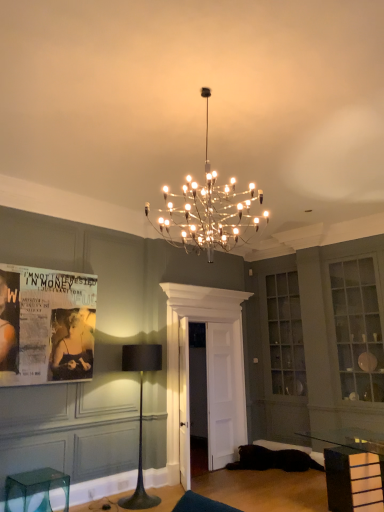
Question: Can you see matte paper poster at left touching black fabric lamp at center?

Choices:
 (A) yes
 (B) no

Answer: (B)

Question: From a real-world perspective, is matte paper poster at left physically above black fabric lamp at center?

Choices:
 (A) yes
 (B) no

Answer: (A)

Question: From a real-world perspective, is matte paper poster at left positioned under black fabric lamp at center based on gravity?

Choices:
 (A) no
 (B) yes

Answer: (A)

Question: Is matte paper poster at left at the left side of black fabric lamp at center?

Choices:
 (A) no
 (B) yes

Answer: (B)

Question: Considering the relative sizes of matte paper poster at left and black fabric lamp at center in the image provided, is matte paper poster at left wider than black fabric lamp at center?

Choices:
 (A) yes
 (B) no

Answer: (B)

Question: Is matte paper poster at left not inside black fabric lamp at center?

Choices:
 (A) yes
 (B) no

Answer: (A)

Question: Can you confirm if clear glass cabinet at upper right is positioned to the right of black fabric lamp at center?

Choices:
 (A) yes
 (B) no

Answer: (A)

Question: Can we say clear glass cabinet at upper right lies outside black fabric lamp at center?

Choices:
 (A) yes
 (B) no

Answer: (A)

Question: Is clear glass cabinet at upper right at the left side of black fabric lamp at center?

Choices:
 (A) yes
 (B) no

Answer: (B)

Question: Considering the relative sizes of clear glass cabinet at upper right and black fabric lamp at center in the image provided, is clear glass cabinet at upper right thinner than black fabric lamp at center?

Choices:
 (A) no
 (B) yes

Answer: (B)

Question: From the image's perspective, is clear glass cabinet at upper right below black fabric lamp at center?

Choices:
 (A) yes
 (B) no

Answer: (B)

Question: Is clear glass cabinet at upper right facing towards black fabric lamp at center?

Choices:
 (A) no
 (B) yes

Answer: (A)

Question: Is clear glass table at lower right to the left of black fabric lamp at center from the viewer's perspective?

Choices:
 (A) yes
 (B) no

Answer: (B)